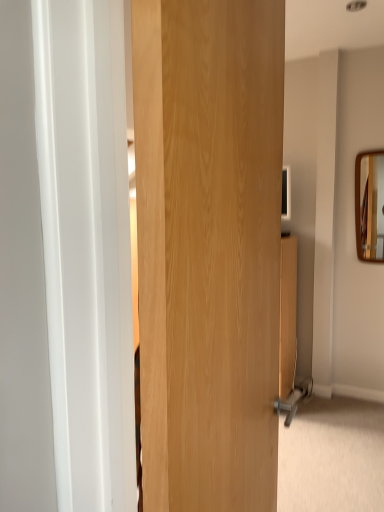
The height and width of the screenshot is (512, 384). Describe the element at coordinates (372, 206) in the screenshot. I see `wooden frame mirror at upper right` at that location.

The width and height of the screenshot is (384, 512). What are the coordinates of `wooden frame mirror at upper right` in the screenshot? It's located at (372, 206).

The image size is (384, 512). What do you see at coordinates (209, 248) in the screenshot?
I see `wooden door at center` at bounding box center [209, 248].

The height and width of the screenshot is (512, 384). I want to click on wooden door at center, so click(x=209, y=248).

You are a GUI agent. You are given a task and a screenshot of the screen. Output one action in this format:
    pyautogui.click(x=<x>, y=<y>)
    Task: Click on the wooden frame mirror at upper right
    
    Given the screenshot: What is the action you would take?
    pyautogui.click(x=372, y=206)

Is wooden door at center to the left of wooden frame mirror at upper right from the viewer's perspective?

Correct, you'll find wooden door at center to the left of wooden frame mirror at upper right.

Is wooden door at center positioned behind wooden frame mirror at upper right?

No, wooden door at center is closer to the viewer.

Which is more distant, (178, 63) or (372, 180)?

The point (372, 180) is more distant.

From the image's perspective, does wooden door at center appear higher than wooden frame mirror at upper right?

Incorrect, from the image's perspective, wooden door at center is lower than wooden frame mirror at upper right.

Based on the photo, from a real-world perspective, which object rests below the other?

In real-world perspective, wooden door at center is lower.

Does wooden door at center have a lesser width compared to wooden frame mirror at upper right?

No, wooden door at center is not thinner than wooden frame mirror at upper right.

In terms of height, does wooden door at center look taller or shorter compared to wooden frame mirror at upper right?

In the image, wooden door at center appears to be taller than wooden frame mirror at upper right.

Considering the sizes of wooden door at center and wooden frame mirror at upper right in the image, is wooden door at center bigger or smaller than wooden frame mirror at upper right?

Clearly, wooden door at center is larger in size than wooden frame mirror at upper right.

Choose the correct answer: Is wooden door at center inside wooden frame mirror at upper right or outside it?

wooden door at center is spatially situated outside wooden frame mirror at upper right.

Is wooden door at center placed right next to wooden frame mirror at upper right?

wooden door at center is not next to wooden frame mirror at upper right, and they're not touching.

Is wooden door at center aimed at wooden frame mirror at upper right?

No.

How many degrees apart are the facing directions of wooden door at center and wooden frame mirror at upper right?

The angle between the facing direction of wooden door at center and the facing direction of wooden frame mirror at upper right is 90 degrees.

How distant is wooden door at center from wooden frame mirror at upper right?

wooden door at center and wooden frame mirror at upper right are 7.53 feet apart from each other.

This screenshot has width=384, height=512. Find the location of `mirror located behind the wooden door at center`. mirror located behind the wooden door at center is located at coordinates (372, 206).

In the scene shown: Would you say wooden frame mirror at upper right is to the left or to the right of wooden door at center in the picture?

Clearly, wooden frame mirror at upper right is on the right of wooden door at center in the image.

Considering the positions of objects wooden frame mirror at upper right and wooden door at center in the image provided, who is in front, wooden frame mirror at upper right or wooden door at center?

wooden door at center is in front.

Considering the points (374, 175) and (211, 49), which point is behind, point (374, 175) or point (211, 49)?

The point (374, 175) is farther.

From the image's perspective, is wooden frame mirror at upper right on top of wooden door at center?

Yes, from the image's perspective, wooden frame mirror at upper right is over wooden door at center.

From a real-world perspective, does wooden frame mirror at upper right sit lower than wooden door at center?

No.

Does wooden frame mirror at upper right have a greater width compared to wooden door at center?

No, wooden frame mirror at upper right is not wider than wooden door at center.

Is wooden frame mirror at upper right taller than wooden door at center?

In fact, wooden frame mirror at upper right may be shorter than wooden door at center.

Which of these two, wooden frame mirror at upper right or wooden door at center, is bigger?

wooden door at center is bigger.

Is wooden frame mirror at upper right outside of wooden door at center?

Absolutely, wooden frame mirror at upper right is external to wooden door at center.

Is wooden frame mirror at upper right next to wooden door at center and touching it?

No, wooden frame mirror at upper right is not next to wooden door at center.

Is wooden frame mirror at upper right aimed at wooden door at center?

Yes, wooden frame mirror at upper right is aimed at wooden door at center.

How different are the orientations of wooden frame mirror at upper right and wooden door at center in degrees?

There is a 90-degree angle between the facing directions of wooden frame mirror at upper right and wooden door at center.

This screenshot has height=512, width=384. In the image, there is a wooden frame mirror at upper right. Find the location of `door below it (from the image's perspective)`. door below it (from the image's perspective) is located at coordinates (209, 248).

Find the location of a particular element. mirror above the wooden door at center (from the image's perspective) is located at coordinates (372, 206).

You are a GUI agent. You are given a task and a screenshot of the screen. Output one action in this format:
    pyautogui.click(x=<x>, y=<y>)
    Task: Click on the door that appears below the wooden frame mirror at upper right (from the image's perspective)
    The width and height of the screenshot is (384, 512).
    Given the screenshot: What is the action you would take?
    pyautogui.click(x=209, y=248)